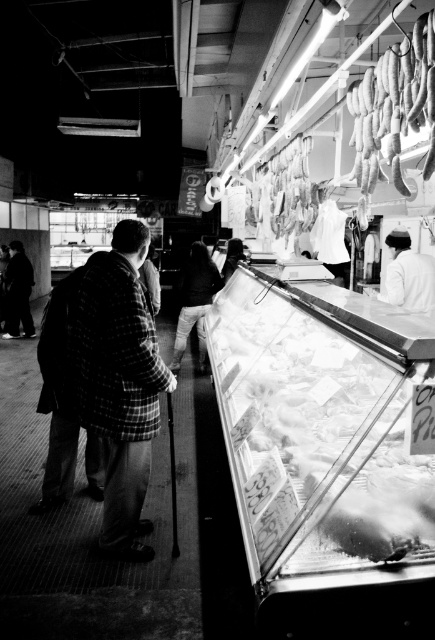
Between point (210, 262) and point (402, 264), which one is positioned behind?

Point (210, 262)

Can you confirm if dark plaid shirt at center is wider than white cotton shirt at upper right?

Indeed, dark plaid shirt at center has a greater width compared to white cotton shirt at upper right.

Image resolution: width=435 pixels, height=640 pixels. Describe the element at coordinates (194, 301) in the screenshot. I see `dark plaid shirt at center` at that location.

Image resolution: width=435 pixels, height=640 pixels. I want to click on dark plaid shirt at center, so click(x=194, y=301).

Is dark clothing at left positioned in front of plaid fabric jacket at center?

That is False.

Does dark clothing at left have a greater height compared to plaid fabric jacket at center?

Indeed, dark clothing at left has a greater height compared to plaid fabric jacket at center.

This screenshot has width=435, height=640. I want to click on dark clothing at left, so click(17, 292).

Who is more forward, (129,301) or (388,67)?

Point (129,301)

At what (x,y) coordinates should I click in order to perform the action: click on plaid wool coat at center. Please return your answer as a coordinate pair (x, y). Looking at the image, I should click on (120, 384).

Image resolution: width=435 pixels, height=640 pixels. Find the location of `plaid wool coat at center`. plaid wool coat at center is located at coordinates (120, 384).

You are a GUI agent. You are given a task and a screenshot of the screen. Output one action in this format:
    pyautogui.click(x=<x>, y=<y>)
    Task: Click on the plaid wool coat at center
    
    Given the screenshot: What is the action you would take?
    pyautogui.click(x=120, y=384)